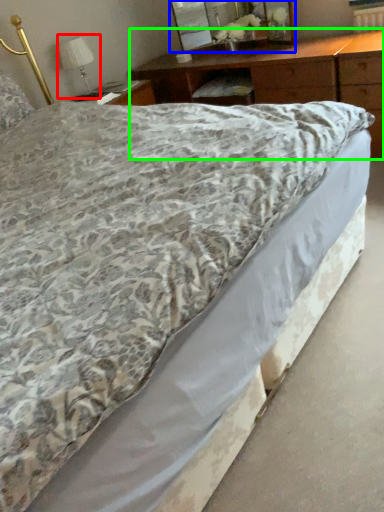
Question: Based on their relative distances, which object is nearer to table lamp (highlighted by a red box)? Choose from mirror (highlighted by a blue box) and nightstand (highlighted by a green box).

Choices:
 (A) mirror
 (B) nightstand

Answer: (B)